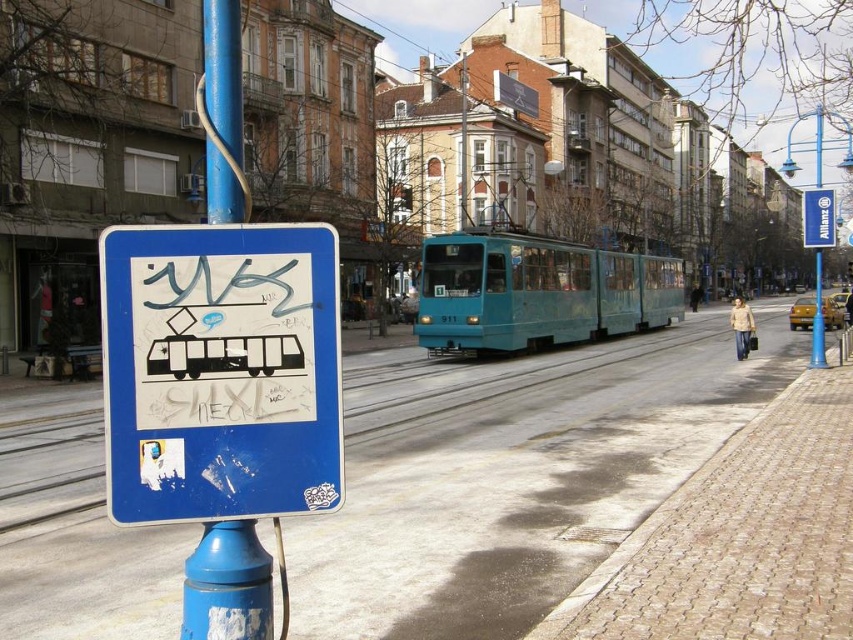
Who is higher up, brick pavement at lower right or blue plastic sign at left?

blue plastic sign at left is above.

Is point (442, 515) more distant than point (190, 488)?

Yes, point (442, 515) is farther from viewer.

At what (x,y) coordinates should I click in order to perform the action: click on brick pavement at lower right. Please return your answer as a coordinate pair (x, y). Looking at the image, I should click on [515, 474].

You are a GUI agent. You are given a task and a screenshot of the screen. Output one action in this format:
    pyautogui.click(x=<x>, y=<y>)
    Task: Click on the brick pavement at lower right
    The height and width of the screenshot is (640, 853).
    Given the screenshot: What is the action you would take?
    pyautogui.click(x=515, y=474)

Between blue plastic sign at left and blue plastic sign at upper center, which one has less height?

Standing shorter between the two is blue plastic sign at left.

Which is above, blue plastic sign at left or blue plastic sign at upper center?

blue plastic sign at upper center

Where is `blue plastic sign at left`? blue plastic sign at left is located at coordinates (219, 371).

Find the location of a particular element. blue plastic sign at left is located at coordinates (219, 371).

Between point (165, 268) and point (212, 160), which one is positioned in front?

Point (165, 268)

Does blue plastic sign at left have a lesser width compared to blue painted metal pole at left?

Yes.

Which is behind, point (200, 401) or point (257, 564)?

The point (257, 564) is more distant.

Where is `blue plastic sign at left`? blue plastic sign at left is located at coordinates (219, 371).